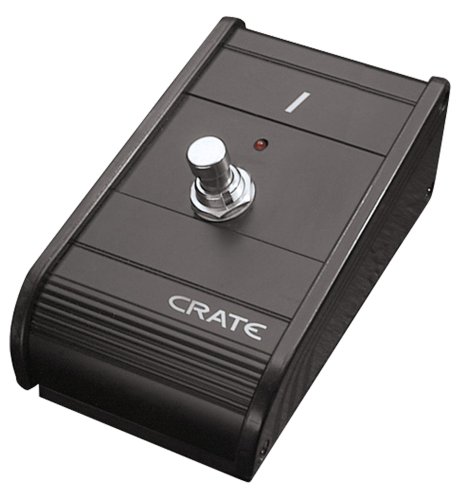
The width and height of the screenshot is (469, 500). Find the location of `wood edges`. wood edges is located at coordinates (323, 331), (58, 246).